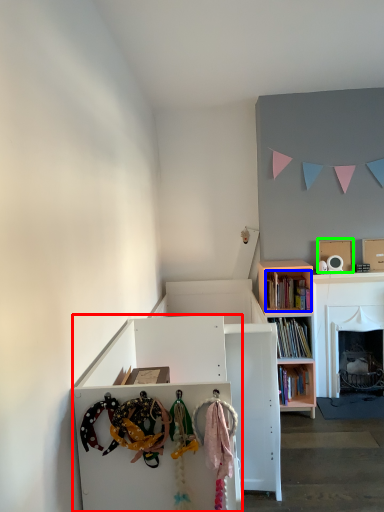
Question: Which object is the closest to the cabinetry (highlighted by a red box)? Choose among these: book (highlighted by a blue box) or cardboard box (highlighted by a green box).

Choices:
 (A) book
 (B) cardboard box

Answer: (A)